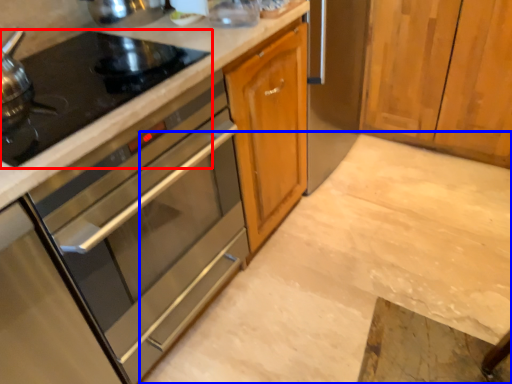
Question: Which object is further to the camera taking this photo, gas stove (highlighted by a red box) or concrete (highlighted by a blue box)?

Choices:
 (A) gas stove
 (B) concrete

Answer: (B)